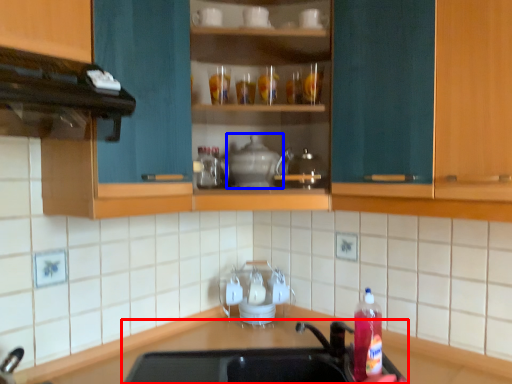
Question: Which point is closer to the camera, sink (highlighted by a red box) or appliance (highlighted by a blue box)?

Choices:
 (A) sink
 (B) appliance

Answer: (A)